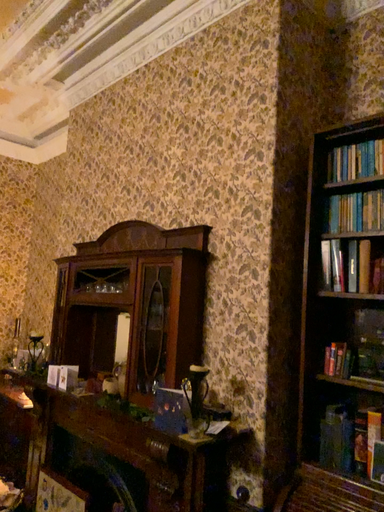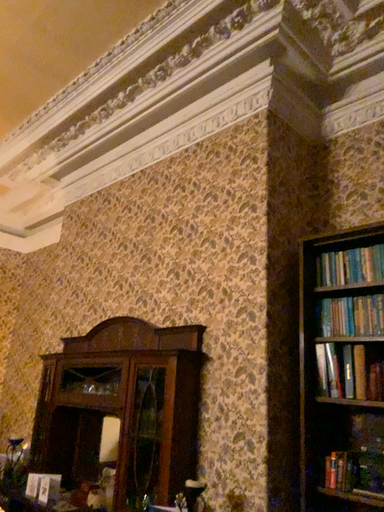
Question: Which way did the camera rotate in the video?

Choices:
 (A) rotated upward
 (B) rotated downward

Answer: (A)